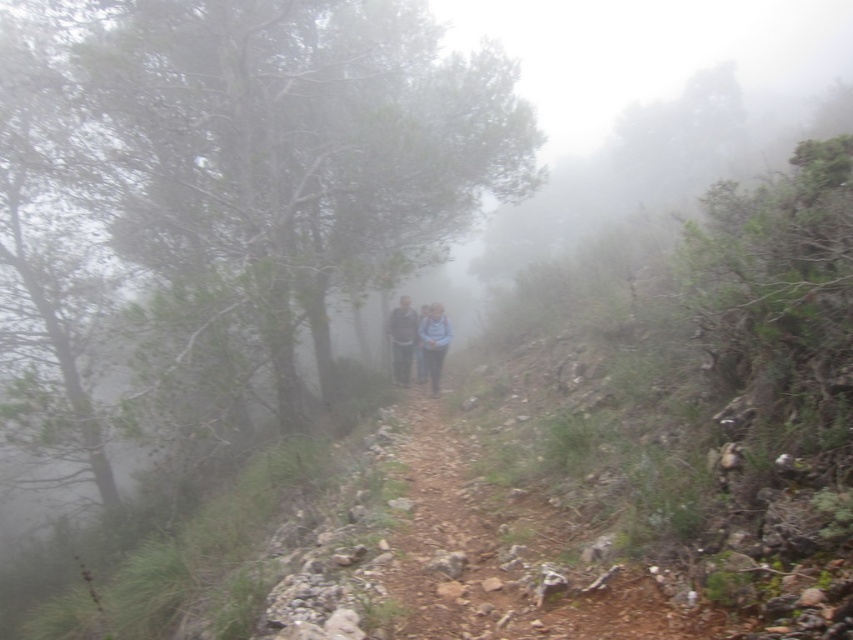
Does blue fabric jacket at center have a lesser height compared to dark gray sweater at center?

No.

Locate an element on the screen. The image size is (853, 640). blue fabric jacket at center is located at coordinates (433, 342).

Which of these two, light blue fabric at center or blue fabric jacket at center, stands shorter?

blue fabric jacket at center

Which is behind, point (393, 355) or point (433, 337)?

Positioned behind is point (393, 355).

Is point (405, 316) less distant than point (440, 372)?

Yes, point (405, 316) is in front of point (440, 372).

I want to click on light blue fabric at center, so click(419, 340).

Does point (393, 332) come in front of point (392, 353)?

That is True.

Does light blue fabric at center have a lesser height compared to dark gray sweater at center?

In fact, light blue fabric at center may be taller than dark gray sweater at center.

You are a GUI agent. You are given a task and a screenshot of the screen. Output one action in this format:
    pyautogui.click(x=<x>, y=<y>)
    Task: Click on the light blue fabric at center
    This screenshot has width=853, height=640.
    Given the screenshot: What is the action you would take?
    pyautogui.click(x=419, y=340)